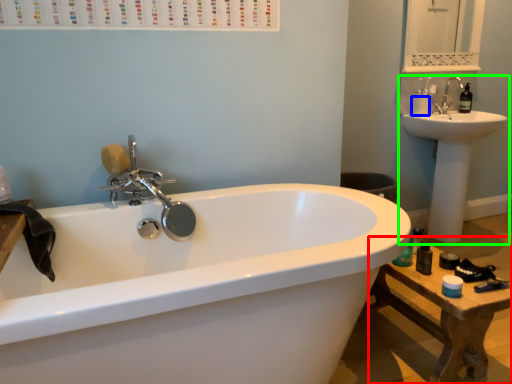
Question: Estimate the real-world distances between objects in this image. Which object is closer to table (highlighted by a red box), toilet paper (highlighted by a blue box) or sink (highlighted by a green box)?

Choices:
 (A) toilet paper
 (B) sink

Answer: (B)